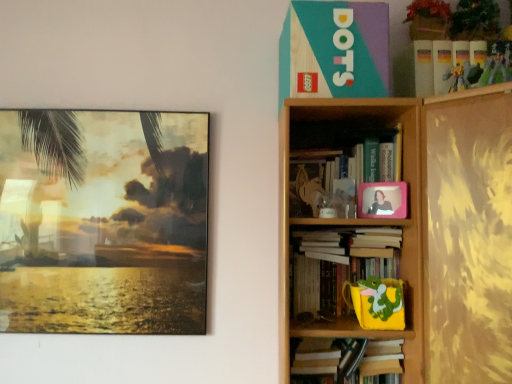
Question: Based on their positions, is wooden bookshelf at upper right located to the left or right of yellow matte cup at lower right, which ranks as the third toy in top-to-bottom order?

Choices:
 (A) left
 (B) right

Answer: (A)

Question: In terms of width, does wooden bookshelf at upper right look wider or thinner when compared to yellow matte cup at lower right, marked as the 3th toy in a right-to-left arrangement?

Choices:
 (A) thin
 (B) wide

Answer: (B)

Question: Based on their relative distances, which object is farther from the pink plastic picture frame at upper right, which appears as the second picture frame when viewed from the back?

Choices:
 (A) plastic action figure at upper right, which ranks as the second toy in front-to-back order
 (B) hardcover book at upper right, which is the fourth book in top-to-bottom order
 (C) white paper at center, positioned as the 3th book in top-to-bottom order
 (D) matte glass painting at left, the 2th picture frame from the front
 (E) yellow matte cup at lower right, which appears as the 3th toy when viewed from the front

Answer: (D)

Question: Which is nearer to the wooden bookshelf at upper right?

Choices:
 (A) metallic silver toy at upper right, which ranks as the second toy in top-to-bottom order
 (B) white paper at center, positioned as the 3th book in top-to-bottom order
 (C) matte glass painting at left, the first picture frame from the left
 (D) hardcover book at upper right, which is the fourth book in top-to-bottom order
 (E) white matte book at upper right, which appears as the 4th book when ordered from the bottom

Answer: (D)